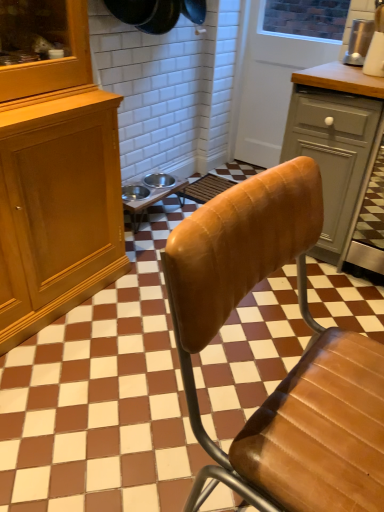
Question: Is metallic silver appliance at upper right beside leather chair at center?

Choices:
 (A) yes
 (B) no

Answer: (B)

Question: Does metallic silver appliance at upper right appear on the right side of leather chair at center?

Choices:
 (A) no
 (B) yes

Answer: (B)

Question: From the image's perspective, is metallic silver appliance at upper right above leather chair at center?

Choices:
 (A) yes
 (B) no

Answer: (A)

Question: From a real-world perspective, does metallic silver appliance at upper right sit lower than leather chair at center?

Choices:
 (A) no
 (B) yes

Answer: (A)

Question: Are metallic silver appliance at upper right and leather chair at center far apart?

Choices:
 (A) yes
 (B) no

Answer: (A)

Question: Would you say matte gray cabinet at right is inside or outside metallic silver bowls at center?

Choices:
 (A) outside
 (B) inside

Answer: (A)

Question: In the image, is matte gray cabinet at right on the left side or the right side of metallic silver bowls at center?

Choices:
 (A) left
 (B) right

Answer: (B)

Question: Is matte gray cabinet at right in front of or behind metallic silver bowls at center in the image?

Choices:
 (A) behind
 (B) front

Answer: (B)

Question: Based on their sizes in the image, would you say matte gray cabinet at right is bigger or smaller than metallic silver bowls at center?

Choices:
 (A) big
 (B) small

Answer: (A)

Question: Looking at the image, does metallic silver bowls at center seem bigger or smaller compared to metallic silver appliance at upper right?

Choices:
 (A) big
 (B) small

Answer: (A)

Question: From a real-world perspective, relative to metallic silver appliance at upper right, is metallic silver bowls at center vertically above or below?

Choices:
 (A) above
 (B) below

Answer: (B)

Question: Looking at their shapes, would you say metallic silver bowls at center is wider or thinner than metallic silver appliance at upper right?

Choices:
 (A) thin
 (B) wide

Answer: (B)

Question: Is metallic silver bowls at center taller or shorter than metallic silver appliance at upper right?

Choices:
 (A) short
 (B) tall

Answer: (A)

Question: Is white wood screen door at upper center taller or shorter than metallic silver appliance at upper right?

Choices:
 (A) tall
 (B) short

Answer: (A)

Question: Looking at the image, does white wood screen door at upper center seem bigger or smaller compared to metallic silver appliance at upper right?

Choices:
 (A) small
 (B) big

Answer: (B)